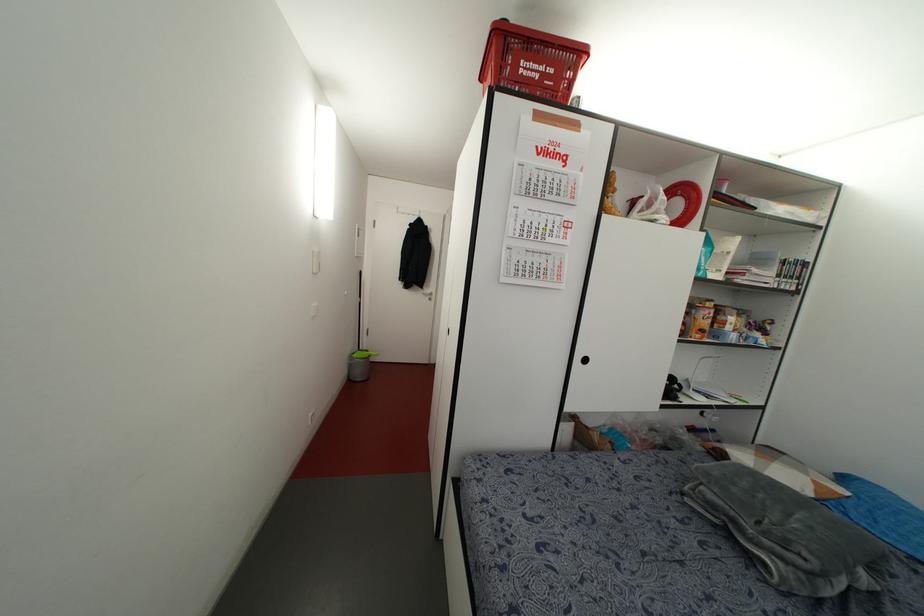
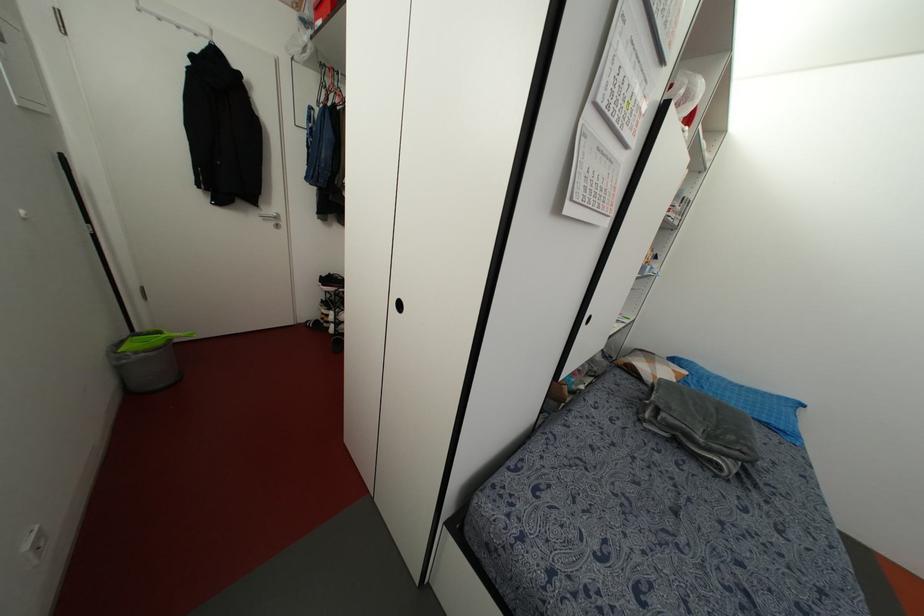
The images are taken continuously from a first-person perspective. In which direction is your viewpoint rotating?

The camera's rotation is toward right-down.